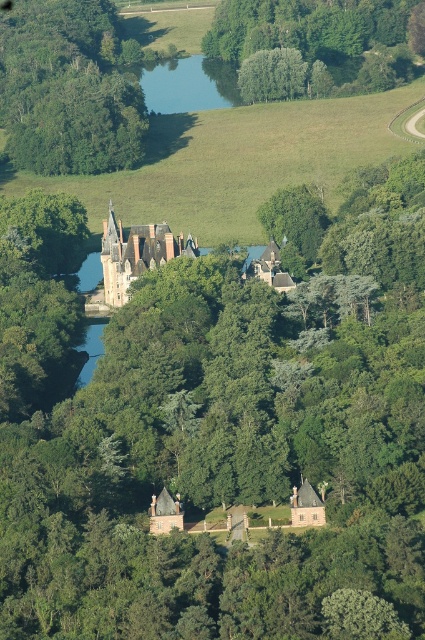
Does green leafy tree at upper left have a greater height compared to blue reflective water at center?

Indeed, green leafy tree at upper left has a greater height compared to blue reflective water at center.

Based on the photo, who is lower down, green leafy tree at upper left or blue reflective water at center?

green leafy tree at upper left is lower down.

Between point (93, 81) and point (217, 90), which one is positioned in front?

Point (93, 81) is in front.

The height and width of the screenshot is (640, 425). I want to click on green leafy tree at upper left, so click(67, 90).

Does brown stone castle at center appear on the left side of brown wooden house at center?

Correct, you'll find brown stone castle at center to the left of brown wooden house at center.

Which is above, brown stone castle at center or brown wooden house at center?

brown stone castle at center is higher up.

This screenshot has width=425, height=640. I want to click on brown stone castle at center, so click(x=136, y=253).

The height and width of the screenshot is (640, 425). Identify the location of brown stone castle at center. tap(136, 253).

Does point (88, 10) come behind point (136, 257)?

Yes, it is.

Does green leafy tree at upper left have a smaller size compared to brown stone castle at center?

Incorrect, green leafy tree at upper left is not smaller in size than brown stone castle at center.

Is point (11, 60) farther from camera compared to point (130, 232)?

Yes, point (11, 60) is behind point (130, 232).

Find the location of `green leafy tree at upper left`. green leafy tree at upper left is located at coordinates (67, 90).